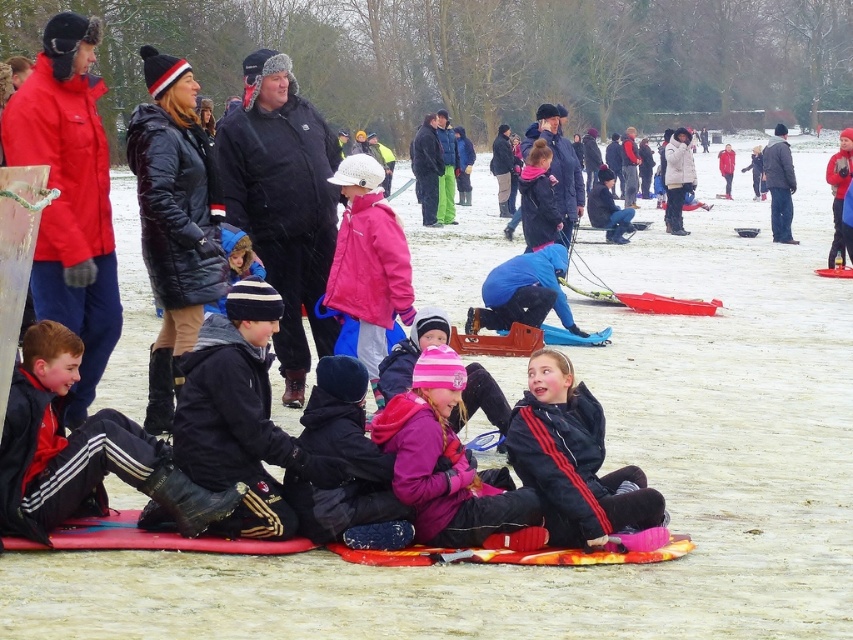
Question: Is black matte coat at upper center positioned in front of black leather jacket at lower left?

Choices:
 (A) no
 (B) yes

Answer: (A)

Question: Does black matte coat at upper center appear on the left side of dark blue fleece jacket at lower center?

Choices:
 (A) no
 (B) yes

Answer: (B)

Question: Which point is farther to the camera?

Choices:
 (A) black matte coat at upper center
 (B) pink matte jacket at center
 (C) dark blue fleece jacket at lower center

Answer: (B)

Question: Among these objects, which one is nearest to the camera?

Choices:
 (A) black leather jacket at lower left
 (B) pink fleece jacket at lower center
 (C) pink matte jacket at center

Answer: (A)

Question: Can you confirm if black matte coat at upper center is positioned to the left of black leather jacket at lower left?

Choices:
 (A) yes
 (B) no

Answer: (B)

Question: Which point is farther from the camera taking this photo?

Choices:
 (A) (293, 314)
 (B) (343, 182)
 (C) (38, 429)
 (D) (616, 515)

Answer: (A)